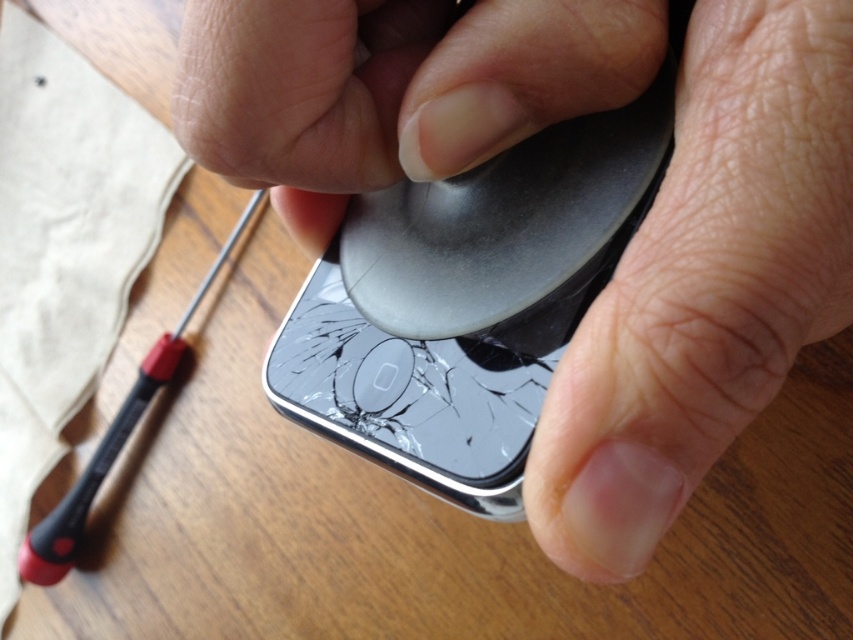
Question: Which of the following is the farthest from the observer?

Choices:
 (A) metallic gray phone at center
 (B) beige fabric at upper left

Answer: (B)

Question: Which of the following is the closest to the observer?

Choices:
 (A) beige fabric at upper left
 (B) metallic gray phone at center

Answer: (B)

Question: Is metallic gray phone at center positioned before smooth matte black phone at center?

Choices:
 (A) yes
 (B) no

Answer: (A)

Question: Among these objects, which one is farthest from the camera?

Choices:
 (A) metallic gray phone at center
 (B) beige fabric at upper left
 (C) smooth matte black phone at center

Answer: (B)

Question: Considering the relative positions of metallic gray phone at center and beige fabric at upper left in the image provided, where is metallic gray phone at center located with respect to beige fabric at upper left?

Choices:
 (A) above
 (B) below

Answer: (B)

Question: Does metallic gray phone at center appear on the left side of beige fabric at upper left?

Choices:
 (A) yes
 (B) no

Answer: (B)